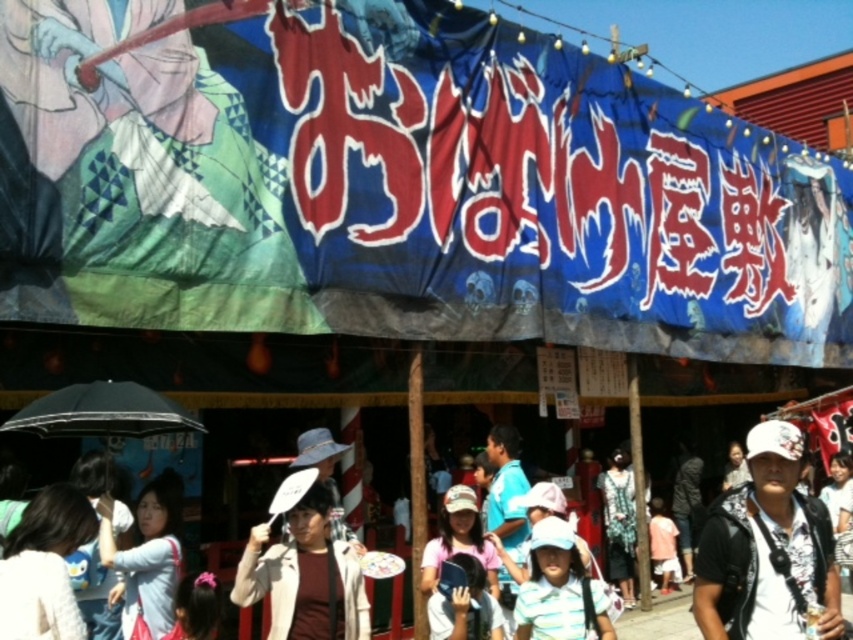
Question: Estimate the real-world distances between objects in this image. Which object is farther from the patterned fabric dress at center?

Choices:
 (A) white matte cap at center
 (B) light blue denim jacket at lower left
 (C) white matte hat at center

Answer: (B)

Question: Is white matte hat at center smaller than light blue denim jacket at lower left?

Choices:
 (A) yes
 (B) no

Answer: (A)

Question: Is white matte cap at center below white matte hat at center?

Choices:
 (A) no
 (B) yes

Answer: (A)

Question: Is white matte hat at center above light blue denim jacket at lower left?

Choices:
 (A) no
 (B) yes

Answer: (A)

Question: Which object appears closest to the camera in this image?

Choices:
 (A) blue fabric banner at upper center
 (B) patterned fabric dress at center
 (C) white matte hat at center
 (D) light blue denim jacket at lower left

Answer: (A)

Question: Which of the following is the farthest from the observer?

Choices:
 (A) patterned fabric dress at center
 (B) light blue denim jacket at lower left
 (C) white fabric umbrella at lower left
 (D) blue fabric banner at upper center

Answer: (A)